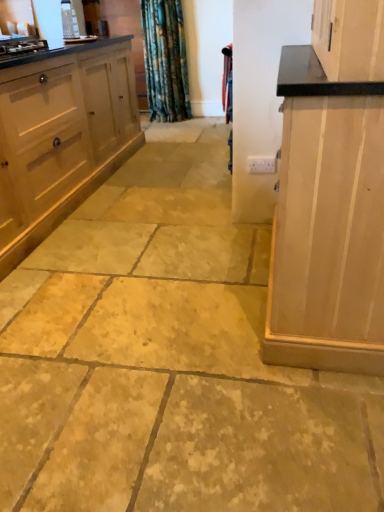
Question: Considering the positions of point (231, 129) and point (331, 112), is point (231, 129) closer or farther from the camera than point (331, 112)?

Choices:
 (A) closer
 (B) farther

Answer: (B)

Question: Considering their positions, is velvet-like red curtain at center located in front of or behind light wood cabinet at right, arranged as the 2th cabinetry when viewed from the left?

Choices:
 (A) behind
 (B) front

Answer: (A)

Question: Estimate the real-world distances between objects in this image. Which object is closer to the light wood cabinet at right, arranged as the 2th cabinetry when viewed from the left?

Choices:
 (A) white wood cabinet at left, positioned as the 1th cabinetry in left-to-right order
 (B) velvet-like red curtain at center

Answer: (B)

Question: Considering the real-world distances, which object is closest to the light wood cabinet at right, which ranks as the 1th cabinetry in right-to-left order?

Choices:
 (A) white wood cabinet at left, marked as the second cabinetry in a right-to-left arrangement
 (B) velvet-like red curtain at center

Answer: (B)